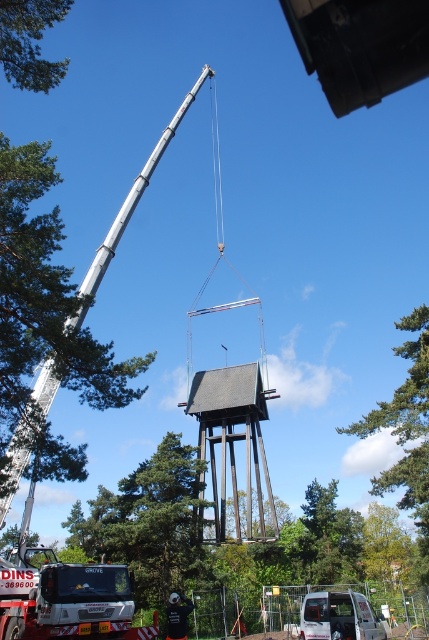
Does green leafy tree at center have a lesser width compared to white metallic truck at lower left?

In fact, green leafy tree at center might be wider than white metallic truck at lower left.

Which is behind, point (160, 481) or point (36, 573)?

The point (160, 481) is behind.

Identify the location of green leafy tree at center. (148, 524).

Is green leafy tree at upper center to the right of white matte van at center from the viewer's perspective?

Correct, you'll find green leafy tree at upper center to the right of white matte van at center.

What do you see at coordinates (407, 433) in the screenshot? I see `green leafy tree at upper center` at bounding box center [407, 433].

What are the coordinates of `green leafy tree at upper center` in the screenshot? It's located at (407, 433).

In the scene shown: Can you confirm if brown wooden tower at center is positioned below green leafy tree at upper left?

Yes.

Which is in front, point (238, 497) or point (30, 68)?

Point (30, 68)

I want to click on brown wooden tower at center, so click(233, 445).